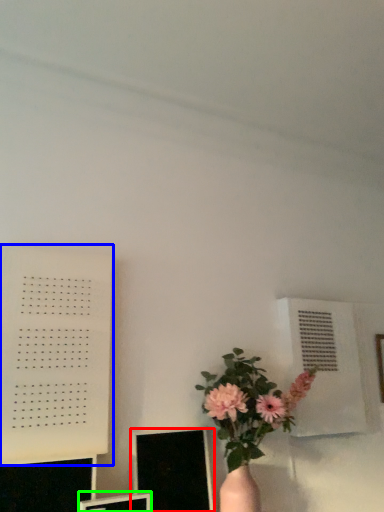
Question: Which object is the closest to the computer monitor (highlighted by a red box)? Choose among these: bulletin board (highlighted by a blue box) or computer monitor (highlighted by a green box).

Choices:
 (A) bulletin board
 (B) computer monitor

Answer: (B)